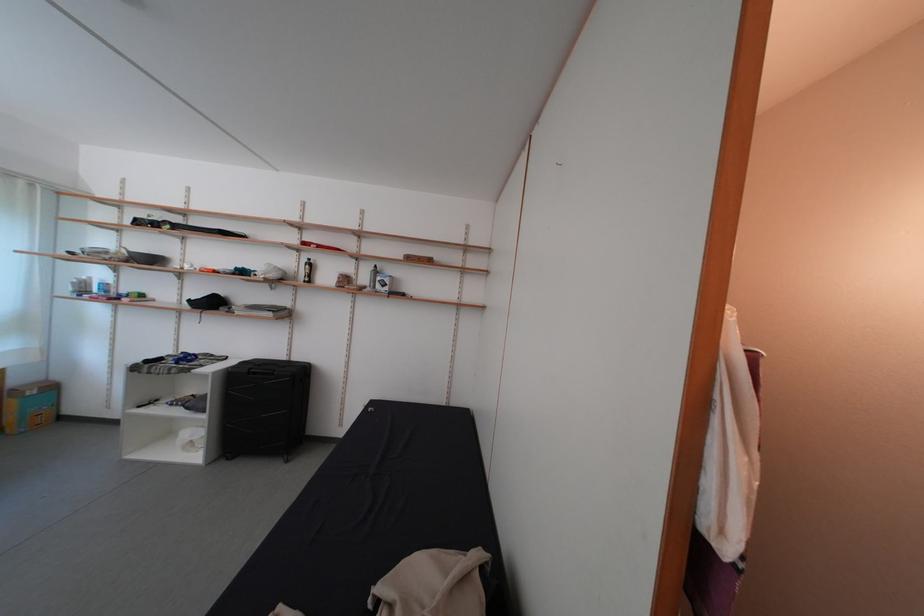
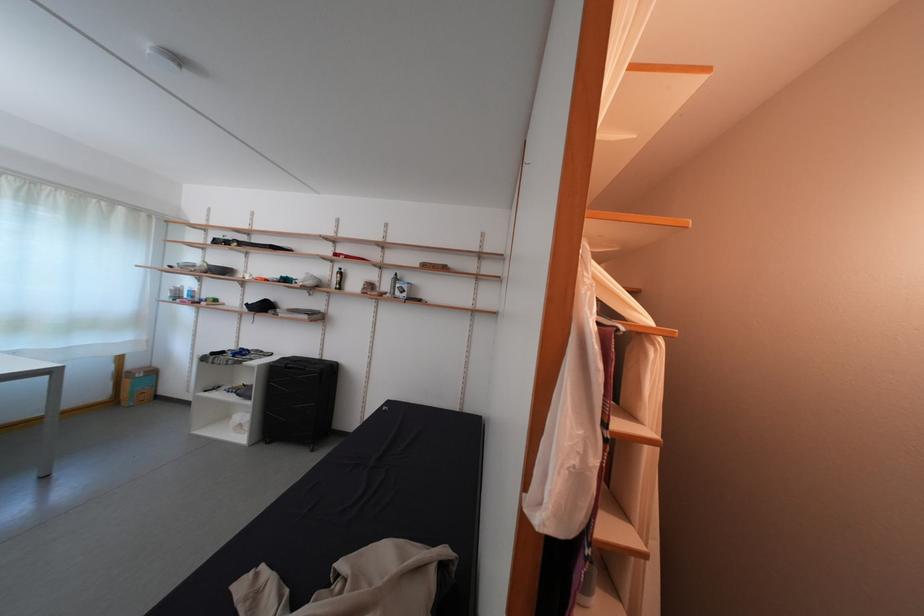
The point at (307, 278) is marked in the first image. Where is the corresponding point in the second image?

(339, 286)